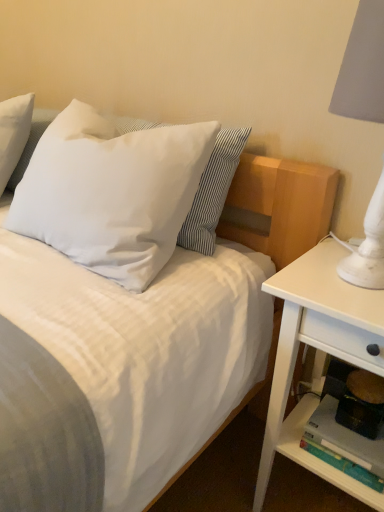
Find the location of a particular element. matte plastic shelf at lower right is located at coordinates (320, 460).

Find the location of a particular element. Image resolution: width=384 pixels, height=512 pixels. white wood nightstand at right is located at coordinates (319, 349).

Does white matte pillow at upper left, positioned as the 2th pillow in right-to-left order, have a smaller size compared to white soft pillow at upper left, placed as the 1th pillow when sorted from right to left?

Correct, white matte pillow at upper left, positioned as the 2th pillow in right-to-left order, occupies less space than white soft pillow at upper left, placed as the 1th pillow when sorted from right to left.

Is white soft pillow at upper left, placed as the 1th pillow when sorted from right to left, surrounded by white matte pillow at upper left, the 1th pillow in the left-to-right sequence?

That's incorrect, white soft pillow at upper left, placed as the 1th pillow when sorted from right to left, is not inside white matte pillow at upper left, the 1th pillow in the left-to-right sequence.

Is white matte pillow at upper left, the 1th pillow in the left-to-right sequence, oriented towards white soft pillow at upper left, placed as the 1th pillow when sorted from right to left?

No, white matte pillow at upper left, the 1th pillow in the left-to-right sequence, is not aimed at white soft pillow at upper left, placed as the 1th pillow when sorted from right to left.

In order to click on pillow on the left of white soft pillow at upper left, acting as the second pillow starting from the left in this screenshot , I will do `click(13, 133)`.

Is white matte pillow at upper left, the 1th pillow in the left-to-right sequence, far away from white wood nightstand at right?

Yes, white matte pillow at upper left, the 1th pillow in the left-to-right sequence, and white wood nightstand at right are located far from each other.

From a real-world perspective, between white matte pillow at upper left, positioned as the 2th pillow in right-to-left order, and white wood nightstand at right, who is vertically lower?

white wood nightstand at right, from a real-world perspective.

From the image's perspective, which is below, white matte pillow at upper left, the 1th pillow in the left-to-right sequence, or white wood nightstand at right?

white wood nightstand at right is shown below in the image.

From a real-world perspective, does matte plastic shelf at lower right sit lower than white wood nightstand at right?

Yes.

Could you tell me if matte plastic shelf at lower right is facing white wood nightstand at right?

Yes, matte plastic shelf at lower right is facing white wood nightstand at right.

Is matte plastic shelf at lower right not close to white wood nightstand at right?

No, matte plastic shelf at lower right is not far away from white wood nightstand at right.

From the image's perspective, is matte plastic shelf at lower right above or below white wood nightstand at right?

matte plastic shelf at lower right is situated lower than white wood nightstand at right in the image.

Does white soft pillow at upper left, acting as the second pillow starting from the left, have a smaller size compared to white wood nightstand at right?

Correct, white soft pillow at upper left, acting as the second pillow starting from the left, occupies less space than white wood nightstand at right.

From a real-world perspective, between white soft pillow at upper left, acting as the second pillow starting from the left, and white wood nightstand at right, who is vertically lower?

From a 3D spatial view, white wood nightstand at right is below.

In the image, is white soft pillow at upper left, acting as the second pillow starting from the left, positioned in front of or behind white wood nightstand at right?

Clearly, white soft pillow at upper left, acting as the second pillow starting from the left, is behind white wood nightstand at right.

In terms of height, does white soft pillow at upper left, acting as the second pillow starting from the left, look taller or shorter compared to white wood nightstand at right?

white soft pillow at upper left, acting as the second pillow starting from the left, is shorter than white wood nightstand at right.

Does white matte pillow at upper left, the 1th pillow in the left-to-right sequence, turn towards matte plastic shelf at lower right?

No.

Which of these two, white matte pillow at upper left, the 1th pillow in the left-to-right sequence, or matte plastic shelf at lower right, stands shorter?

Standing shorter between the two is matte plastic shelf at lower right.

The image size is (384, 512). In the image, there is a white matte pillow at upper left, the 1th pillow in the left-to-right sequence. In order to click on shelf below it (from a real-world perspective) in this screenshot , I will do (320, 460).

Consider the image. Is white matte pillow at upper left, the 1th pillow in the left-to-right sequence, smaller than matte plastic shelf at lower right?

Incorrect, white matte pillow at upper left, the 1th pillow in the left-to-right sequence, is not smaller in size than matte plastic shelf at lower right.

From the image's perspective, which is below, white wood nightstand at right or matte plastic shelf at lower right?

From the image's view, matte plastic shelf at lower right is below.

You are a GUI agent. You are given a task and a screenshot of the screen. Output one action in this format:
    pyautogui.click(x=<x>, y=<y>)
    Task: Click on the nightstand above the matte plastic shelf at lower right (from the image's perspective)
    The width and height of the screenshot is (384, 512).
    Given the screenshot: What is the action you would take?
    pyautogui.click(x=319, y=349)

Is white wood nightstand at right facing away from matte plastic shelf at lower right?

Yes, white wood nightstand at right is positioned with its back facing matte plastic shelf at lower right.

Between white wood nightstand at right and matte plastic shelf at lower right, which one has larger size?

With larger size is white wood nightstand at right.

Considering the positions of objects white wood nightstand at right and white soft pillow at upper left, placed as the 1th pillow when sorted from right to left, in the image provided, who is behind, white wood nightstand at right or white soft pillow at upper left, placed as the 1th pillow when sorted from right to left,?

white soft pillow at upper left, placed as the 1th pillow when sorted from right to left.

Is white wood nightstand at right turned away from white soft pillow at upper left, placed as the 1th pillow when sorted from right to left?

No, white wood nightstand at right is not facing away from white soft pillow at upper left, placed as the 1th pillow when sorted from right to left.

Find the location of a particular element. This screenshot has height=512, width=384. the 1st pillow above the white wood nightstand at right (from the image's perspective) is located at coordinates (111, 192).

Considering the points (322, 298) and (160, 241), which point is in front, point (322, 298) or point (160, 241)?

Point (322, 298)

I want to click on pillow in front of the white matte pillow at upper left, positioned as the 2th pillow in right-to-left order, so click(x=111, y=192).

Locate an element on the screen. The height and width of the screenshot is (512, 384). nightstand that appears on the right of white matte pillow at upper left, positioned as the 2th pillow in right-to-left order is located at coordinates (319, 349).

When comparing their distances from matte plastic shelf at lower right, does white matte pillow at upper left, the 1th pillow in the left-to-right sequence, or white soft pillow at upper left, placed as the 1th pillow when sorted from right to left, seem further?

white matte pillow at upper left, the 1th pillow in the left-to-right sequence, lies further to matte plastic shelf at lower right than the other object.

Estimate the real-world distances between objects in this image. Which object is closer to white matte pillow at upper left, positioned as the 2th pillow in right-to-left order, white soft pillow at upper left, placed as the 1th pillow when sorted from right to left, or white wood nightstand at right?

white soft pillow at upper left, placed as the 1th pillow when sorted from right to left, is closer to white matte pillow at upper left, positioned as the 2th pillow in right-to-left order.

Based on their spatial positions, is matte plastic shelf at lower right or white soft pillow at upper left, acting as the second pillow starting from the left, further from white matte pillow at upper left, positioned as the 2th pillow in right-to-left order?

Among the two, matte plastic shelf at lower right is located further to white matte pillow at upper left, positioned as the 2th pillow in right-to-left order.

Considering their positions, is white wood nightstand at right positioned closer to white soft pillow at upper left, acting as the second pillow starting from the left, than white matte pillow at upper left, positioned as the 2th pillow in right-to-left order?

white matte pillow at upper left, positioned as the 2th pillow in right-to-left order.

From the picture: From the image, which object appears to be nearer to white wood nightstand at right, matte plastic shelf at lower right or white soft pillow at upper left, acting as the second pillow starting from the left?

matte plastic shelf at lower right is closer to white wood nightstand at right.

Estimate the real-world distances between objects in this image. Which object is closer to white soft pillow at upper left, placed as the 1th pillow when sorted from right to left, white matte pillow at upper left, positioned as the 2th pillow in right-to-left order, or matte plastic shelf at lower right?

white matte pillow at upper left, positioned as the 2th pillow in right-to-left order, is closer to white soft pillow at upper left, placed as the 1th pillow when sorted from right to left.

Based on their spatial positions, is matte plastic shelf at lower right or white matte pillow at upper left, positioned as the 2th pillow in right-to-left order, closer to white wood nightstand at right?

matte plastic shelf at lower right.

When comparing their distances from matte plastic shelf at lower right, does white wood nightstand at right or white soft pillow at upper left, acting as the second pillow starting from the left, seem further?

white soft pillow at upper left, acting as the second pillow starting from the left, is further to matte plastic shelf at lower right.

Where is `nightstand between white matte pillow at upper left, positioned as the 2th pillow in right-to-left order, and matte plastic shelf at lower right`? The image size is (384, 512). nightstand between white matte pillow at upper left, positioned as the 2th pillow in right-to-left order, and matte plastic shelf at lower right is located at coordinates (319, 349).

The width and height of the screenshot is (384, 512). I want to click on nightstand located between white soft pillow at upper left, placed as the 1th pillow when sorted from right to left, and matte plastic shelf at lower right in the left-right direction, so click(x=319, y=349).

The image size is (384, 512). I want to click on pillow between white matte pillow at upper left, the 1th pillow in the left-to-right sequence, and matte plastic shelf at lower right, in the horizontal direction, so click(111, 192).

Locate an element on the screen. The image size is (384, 512). pillow located between white matte pillow at upper left, the 1th pillow in the left-to-right sequence, and white wood nightstand at right in the left-right direction is located at coordinates (111, 192).